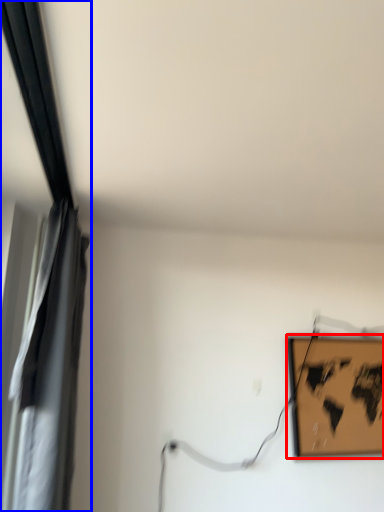
Question: Which object appears closest to the camera in this image, picture frame (highlighted by a red box) or curtain (highlighted by a blue box)?

Choices:
 (A) picture frame
 (B) curtain

Answer: (B)